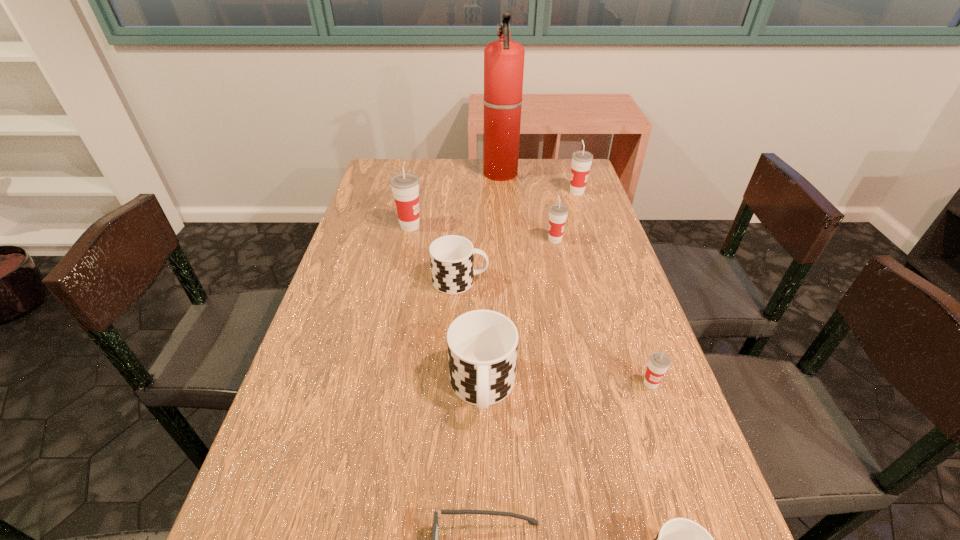
Find the location of a particular element. This screenshot has height=540, width=960. vacant region at the left edge of the desktop is located at coordinates (370, 232).

Where is `vacant space at the right edge`? This screenshot has width=960, height=540. vacant space at the right edge is located at coordinates (643, 376).

The width and height of the screenshot is (960, 540). I want to click on free space at the far left corner of the desktop, so click(x=384, y=163).

This screenshot has width=960, height=540. Identify the location of vacant area at the far right corner of the desktop. (554, 181).

Image resolution: width=960 pixels, height=540 pixels. Identify the location of empty location between the fire extinguisher and the nearest red cup. (576, 279).

Where is `unoccupied area between the second smallest black cup and the smallest red cup`? The image size is (960, 540). unoccupied area between the second smallest black cup and the smallest red cup is located at coordinates (556, 332).

Locate which object ranks fourth in proximity to the farthest black cup. Please provide its 2D coordinates. Your answer should be formatted as a tuple, i.e. [(x, y)], where the tuple contains the x and y coordinates of a point satisfying the conditions above.

[(659, 362)]

Find the location of `object that is the third closest to the smallest red cup`. object that is the third closest to the smallest red cup is located at coordinates (437, 515).

You are a GUI agent. You are given a task and a screenshot of the screen. Output one action in this format:
    pyautogui.click(x=<x>, y=<y>)
    Task: Click on the fifth closest cup relative to the nearest red cup
    The width and height of the screenshot is (960, 540).
    Given the screenshot: What is the action you would take?
    (405, 186)

Choose which cup is the fifth nearest neighbor to the sixth nearest object. Please provide its 2D coordinates. Your answer should be formatted as a tuple, i.e. [(x, y)], where the tuple contains the x and y coordinates of a point satisfying the conditions above.

[(659, 362)]